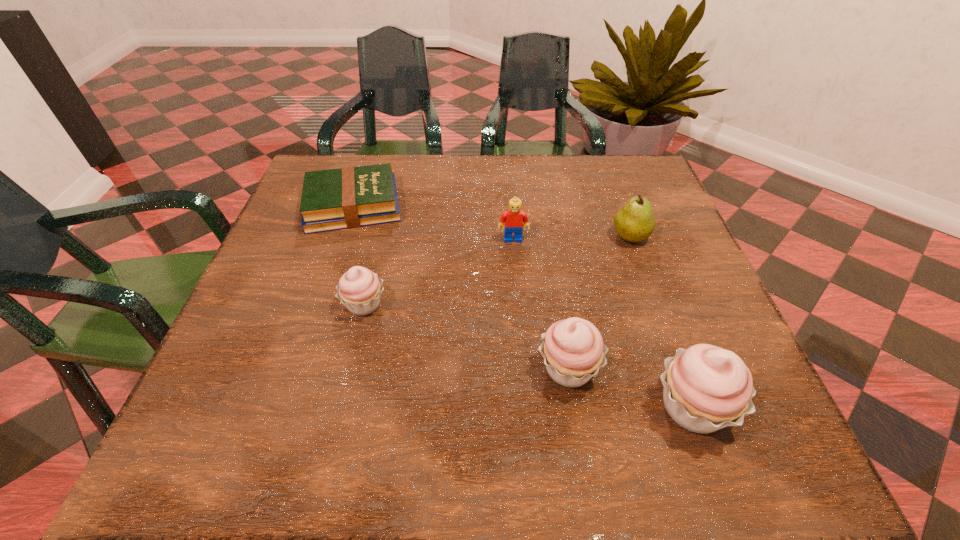
This screenshot has width=960, height=540. In order to click on free space located on the left of the rightmost cupcake in this screenshot , I will do `click(436, 408)`.

Identify the location of free space located 0.390m on the front of the shortest object. (294, 383).

Find the location of `free space located 0.070m on the back of the pear`. free space located 0.070m on the back of the pear is located at coordinates (619, 206).

Identify the location of free space located 0.080m on the face of the Lego. The image size is (960, 540). (516, 268).

At what (x,y) coordinates should I click in order to perform the action: click on object present at the far edge. Please return your answer as a coordinate pair (x, y). Looking at the image, I should click on click(348, 197).

The image size is (960, 540). In order to click on object at the left edge in this screenshot , I will do `click(348, 197)`.

This screenshot has height=540, width=960. Identify the location of cupcake situated at the right edge. (706, 388).

Locate an element on the screen. The width and height of the screenshot is (960, 540). pear located at the right edge is located at coordinates (634, 222).

At what (x,y) coordinates should I click in order to perform the action: click on object that is at the far left corner. Please return your answer as a coordinate pair (x, y). This screenshot has width=960, height=540. Looking at the image, I should click on (348, 197).

I want to click on object that is at the near right corner, so coord(706,388).